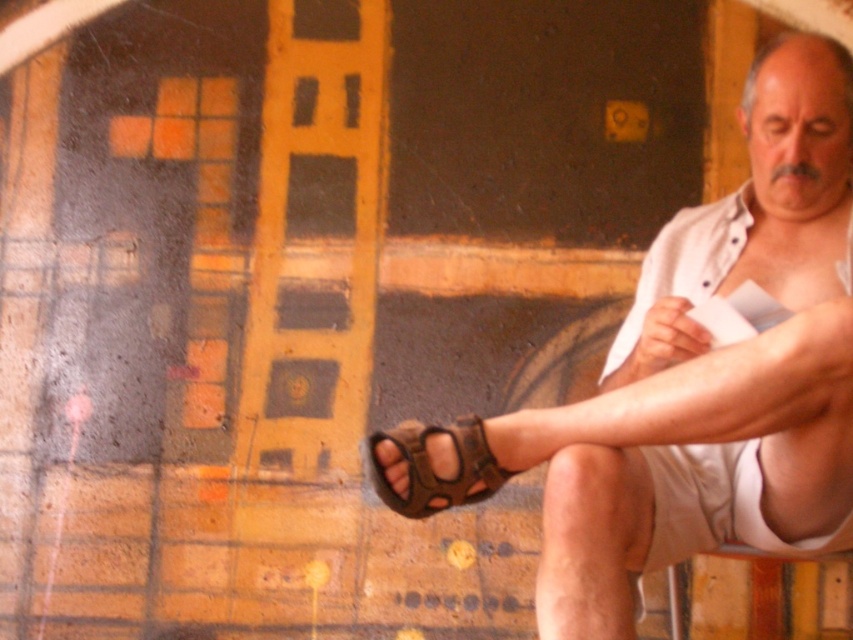
You are a photographer trying to capture the man sitting on the bench. You notice two brown leather sandals in the scene. Which sandal, the brown leather sandals at lower left or the brown leather sandal at lower right, will appear larger in your photo?

The brown leather sandals at lower left will appear larger in the photo because it is much taller than the brown leather sandal at lower right.

You are standing in front of the man sitting on the bench and looking down at his feet. You see the brown leather sandals at lower left and the brown leather sandal at lower right. Which sandal is positioned to the right of the other?

The brown leather sandals at lower left are positioned to the right of the brown leather sandal at lower right.

You are a photographer taking a picture of the man sitting on the bench. You notice the brown leather sandals at lower left and the brown leather sandal at lower right. Which one is closer to the camera?

The brown leather sandals at lower left is closer to the camera because it is positioned in front of the brown leather sandal at lower right.